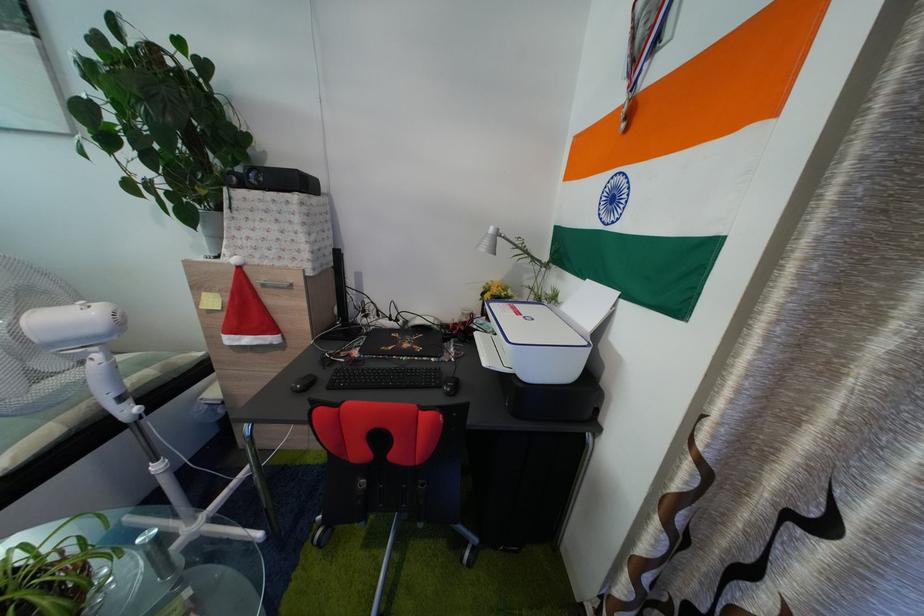
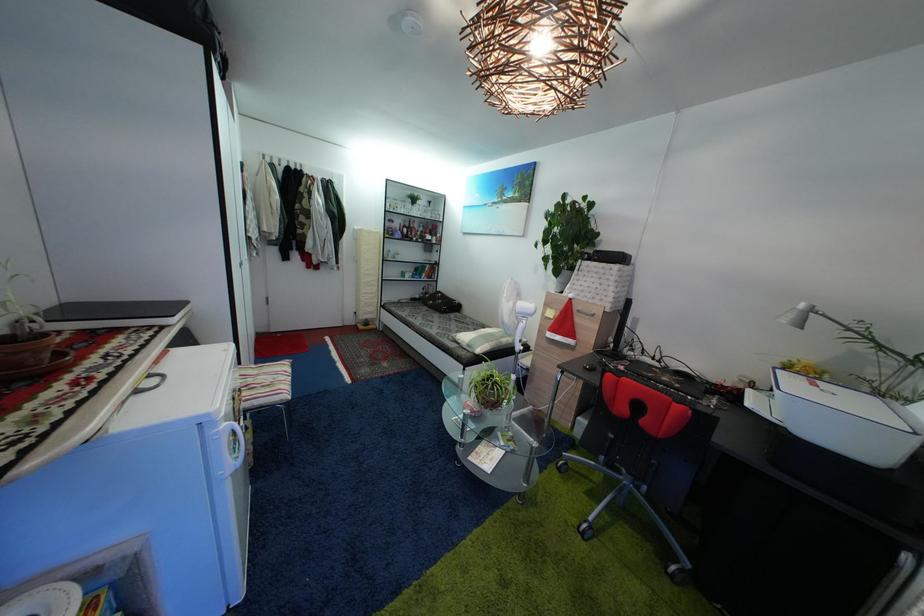
Question: The camera is either moving clockwise (left) or counter-clockwise (right) around the object. The first image is from the beginning of the video and the second image is from the end. Is the camera moving left or right when shooting the video?

Choices:
 (A) Left
 (B) Right

Answer: (B)